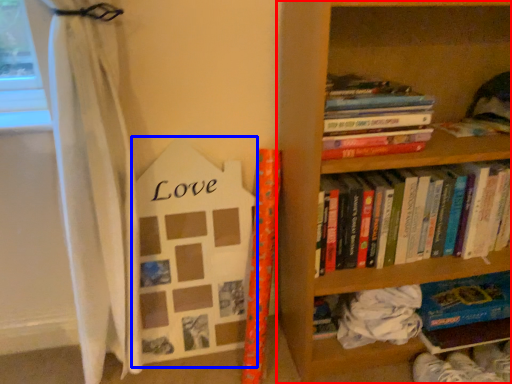
Question: Which point is closer to the camera, bookcase (highlighted by a red box) or paperback book (highlighted by a blue box)?

Choices:
 (A) bookcase
 (B) paperback book

Answer: (A)